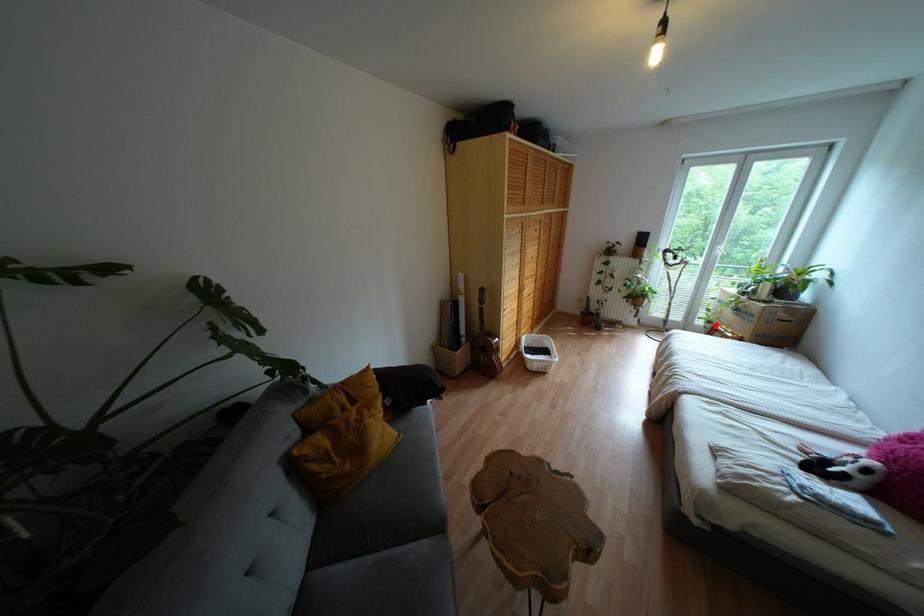
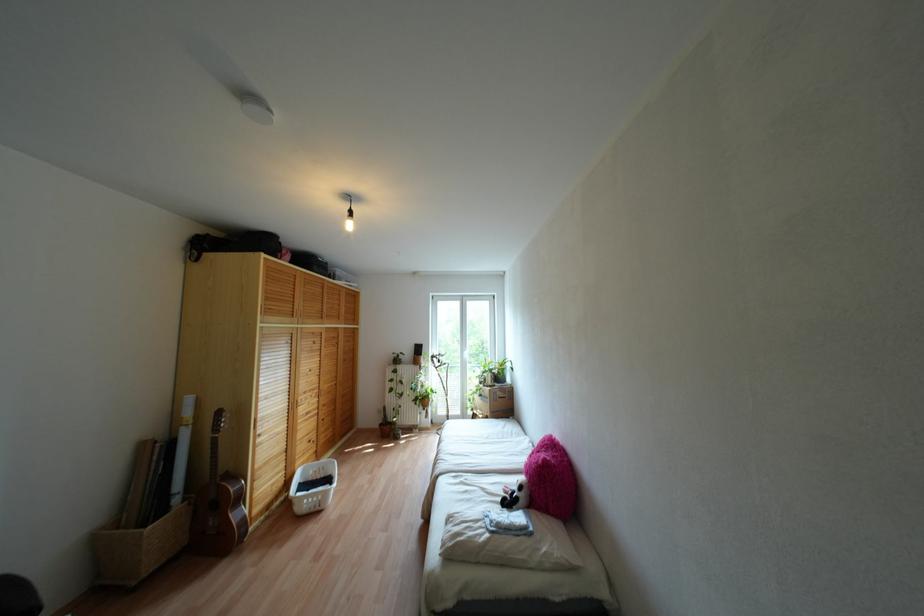
Locate, in the second image, the point that corresponds to the highlighted location in the first image.

(473, 411)